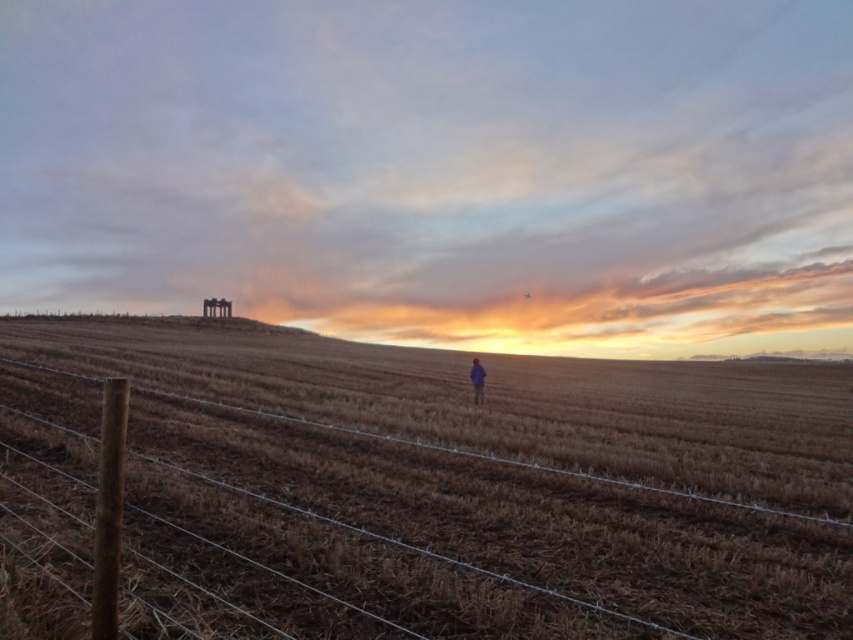
Question: Is the position of brown grass at center more distant than that of blue fabric person at center?

Choices:
 (A) no
 (B) yes

Answer: (A)

Question: Considering the relative positions of brown grass at center and blue fabric person at center in the image provided, where is brown grass at center located with respect to blue fabric person at center?

Choices:
 (A) above
 (B) below

Answer: (B)

Question: Which point appears closest to the camera in this image?

Choices:
 (A) click(x=695, y=483)
 (B) click(x=477, y=365)

Answer: (A)

Question: Which of the following is the closest to the observer?

Choices:
 (A) blue fabric person at center
 (B) brown grass at center

Answer: (B)

Question: Which point appears closest to the camera in this image?

Choices:
 (A) (780, 438)
 (B) (473, 397)

Answer: (A)

Question: Is the position of brown grass at center less distant than that of blue fabric person at center?

Choices:
 (A) no
 (B) yes

Answer: (B)